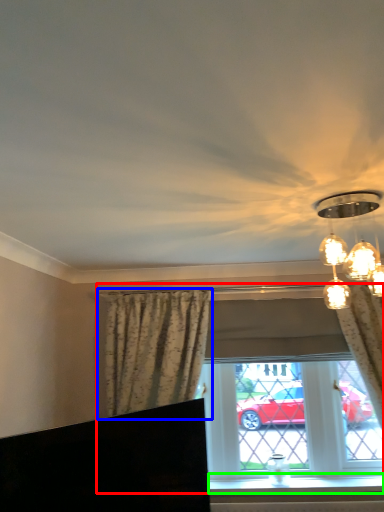
Question: Based on their relative distances, which object is nearer to window (highlighted by a red box)? Choose from curtain (highlighted by a blue box) and window sill (highlighted by a green box).

Choices:
 (A) curtain
 (B) window sill

Answer: (B)